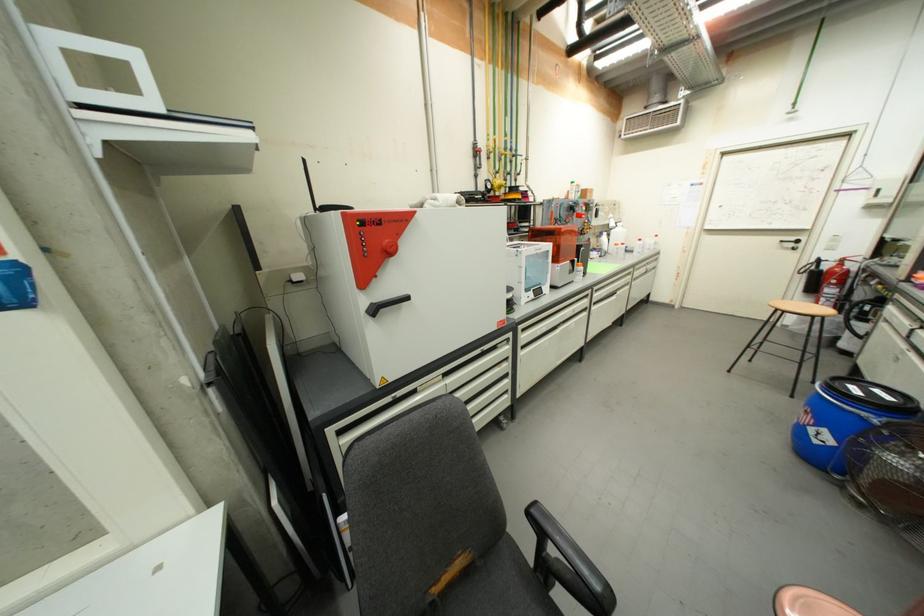
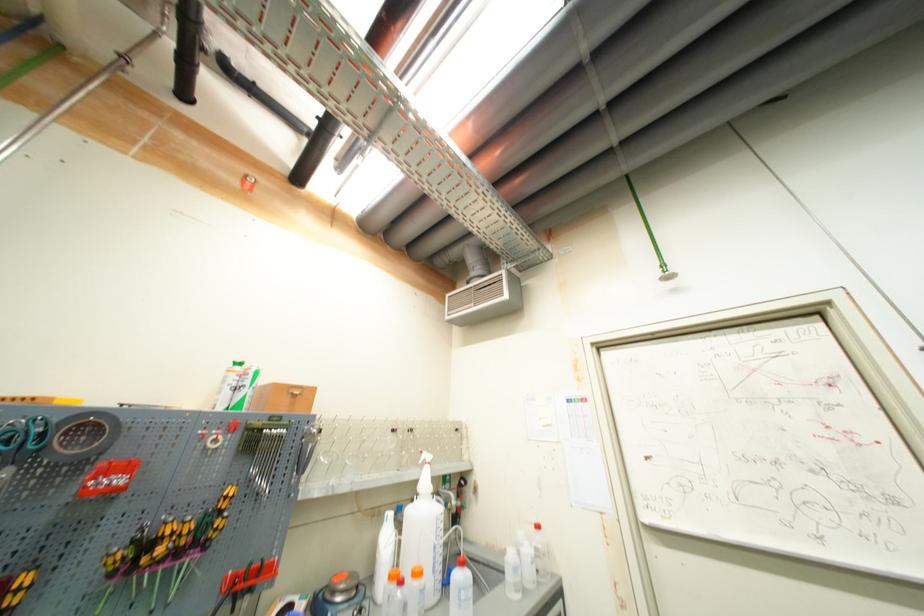
Where in the second image is the point corresponding to point (614, 225) from the first image?

(421, 484)